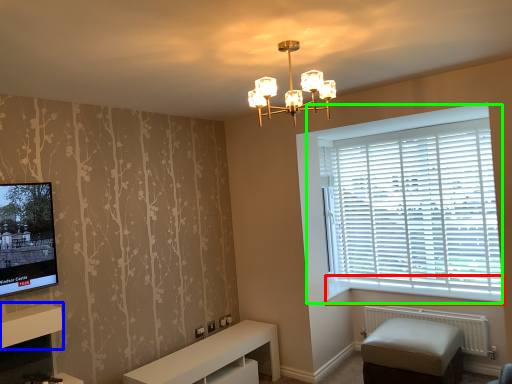
Question: Considering the real-world distances, which object is closest to window sill (highlighted by a red box)? shelf (highlighted by a blue box) or window (highlighted by a green box).

Choices:
 (A) shelf
 (B) window

Answer: (B)